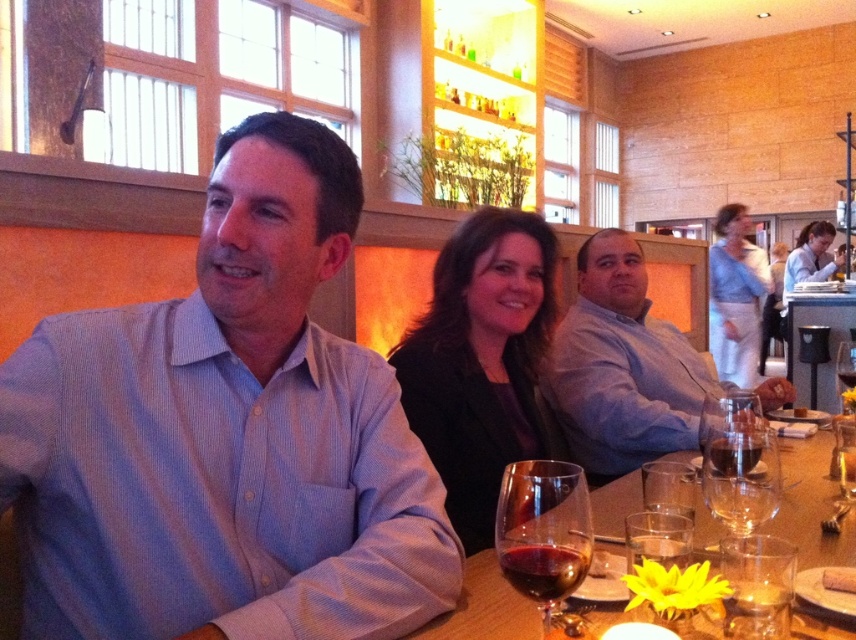
Is point (289, 548) more distant than point (461, 616)?

Yes.

Can you confirm if light blue striped shirt at left is positioned to the left of translucent glass wine at center?

Yes, light blue striped shirt at left is to the left of translucent glass wine at center.

This screenshot has width=856, height=640. Identify the location of light blue striped shirt at left. (226, 436).

Locate an element on the screen. clear glass table at center is located at coordinates (827, 344).

Does clear glass table at center have a larger size compared to dark red glass at lower center?

Yes, clear glass table at center is bigger than dark red glass at lower center.

This screenshot has height=640, width=856. What do you see at coordinates (827, 344) in the screenshot?
I see `clear glass table at center` at bounding box center [827, 344].

This screenshot has height=640, width=856. What are the coordinates of `clear glass table at center` in the screenshot? It's located at (827, 344).

Who is taller, light blue striped shirt at left or clear glass table at center?

Standing taller between the two is clear glass table at center.

Can you confirm if light blue striped shirt at left is thinner than clear glass table at center?

Correct, light blue striped shirt at left's width is less than clear glass table at center's.

This screenshot has width=856, height=640. What do you see at coordinates (226, 436) in the screenshot? I see `light blue striped shirt at left` at bounding box center [226, 436].

I want to click on light blue striped shirt at left, so click(x=226, y=436).